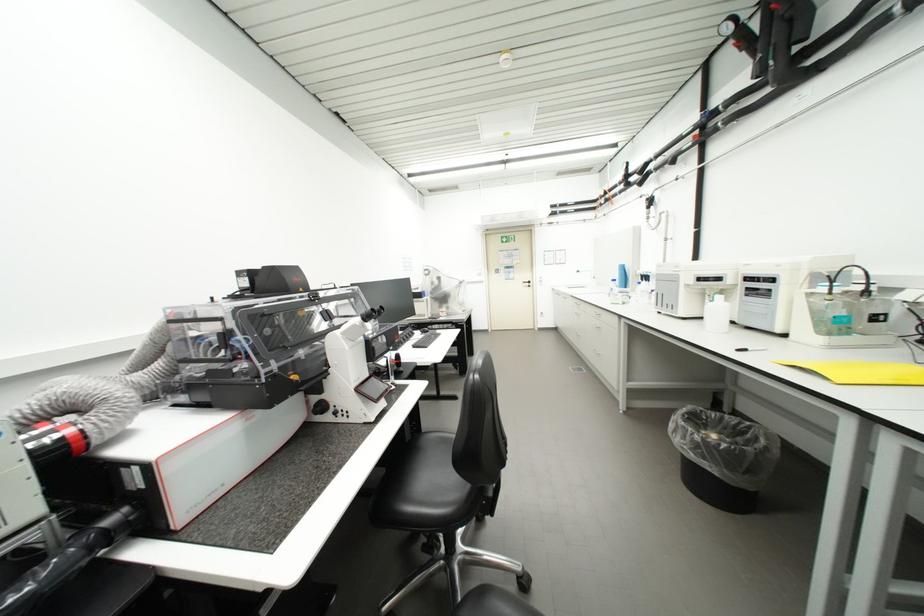
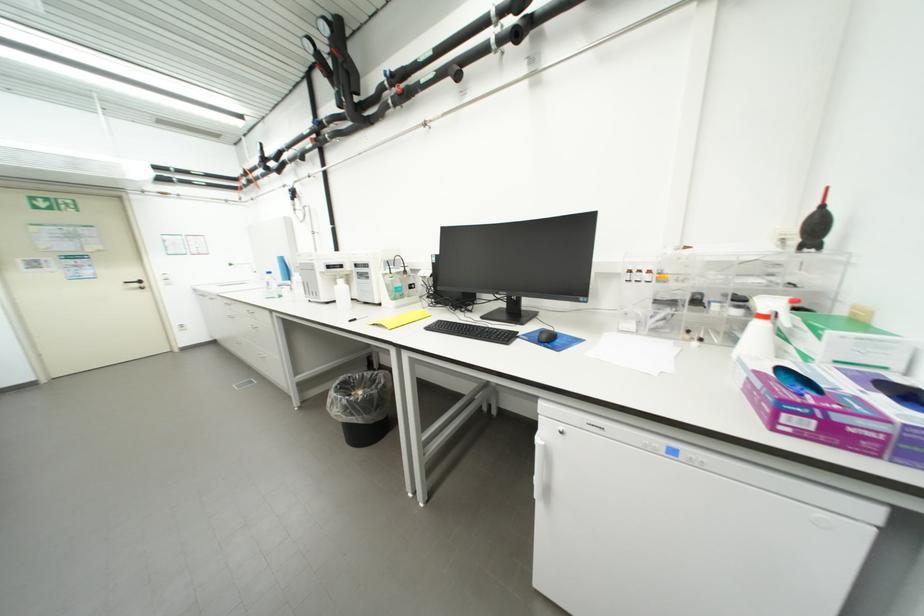
Question: The images are taken continuously from a first-person perspective. In which direction is your viewpoint rotating?

Choices:
 (A) Left
 (B) Right
 (C) Up
 (D) Down

Answer: (B)